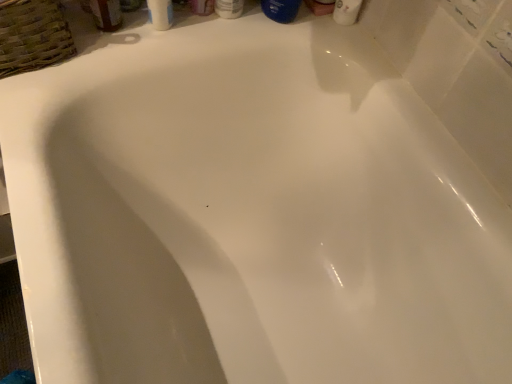
Where is `free point to the right of translucent plastic mouthwash at upper left, the 1th mouthwash viewed from the left`? free point to the right of translucent plastic mouthwash at upper left, the 1th mouthwash viewed from the left is located at coordinates (178, 29).